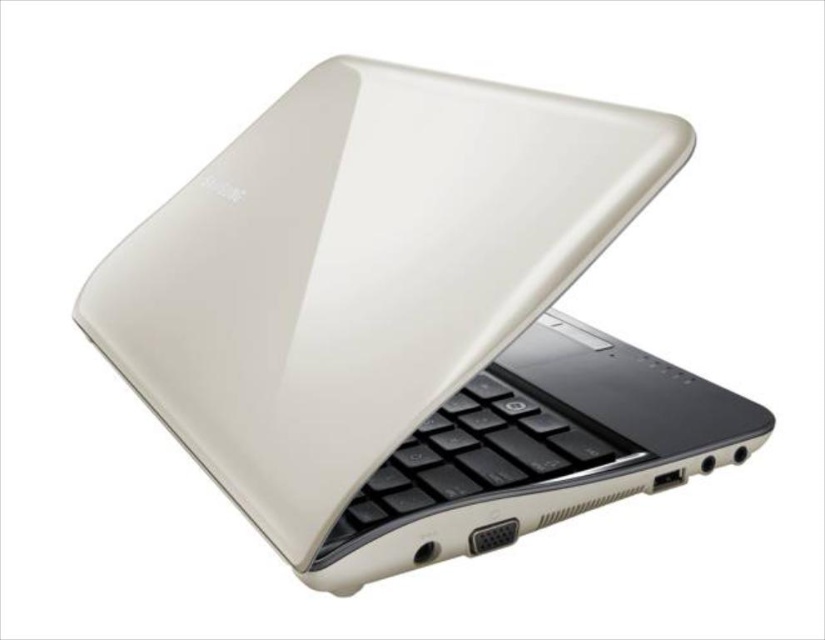
You are examining a laptop from the side. You notice two points labeled as point 1 and point 2. Point 1 is at coordinates (210, 369) and point 2 is at (510, 388). Which point is closer to you?

Point 1 is closer to you because it is closer to the viewer than point 2.

You are setting up a laptop and keyboard on a desk. The scene shows a satin white laptop at center and a black matte keyboard at center. According to the image, which object is located to the left of the other?

The satin white laptop at center is positioned on the left side of black matte keyboard at center.

You are setting up a desk for a small workspace. You have a satin white laptop at center and a black matte keyboard at center. Considering their sizes, which object should you place first to ensure there is enough space for both?

The satin white laptop at center is taller than the black matte keyboard at center, so you should place the satin white laptop at center first to ensure there is enough vertical space for both items.